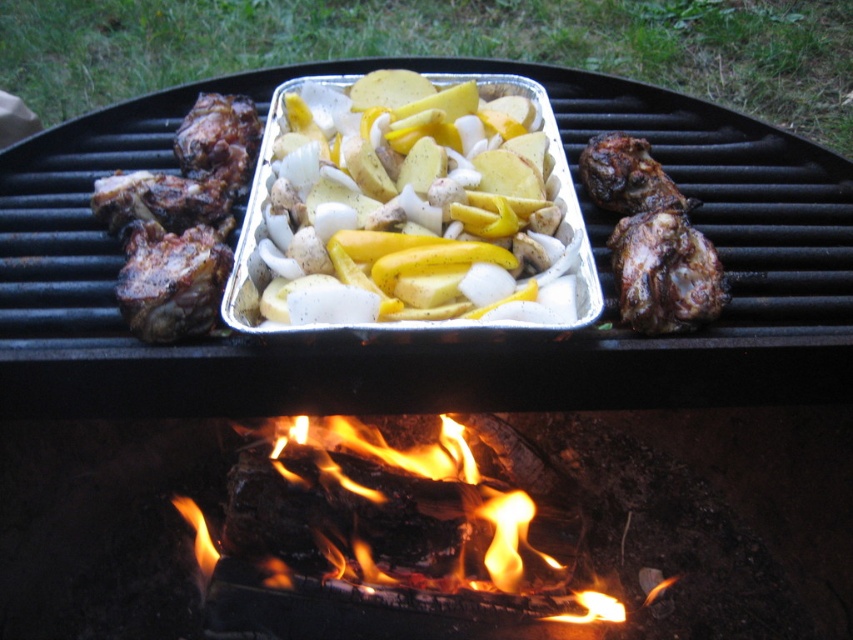
You are a drone operator trying to capture a closeup of the vegetables in the tray. You have two points marked in the scene, point 1 at coordinates point (317, 124) and point 2 at coordinates point (306, 442). Which point should you focus on to get the closest shot of the vegetables?

Point (317, 124) is closer to the camera than point (306, 442), so you should focus on point (317, 124) to get the closest shot of the vegetables.